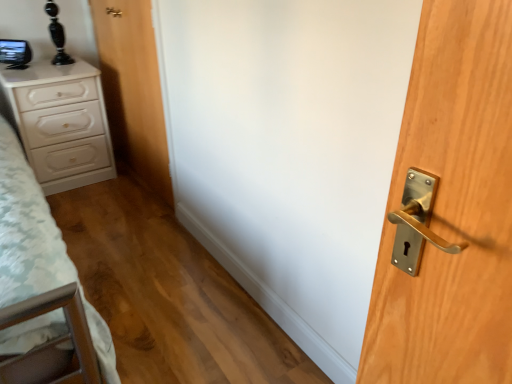
Question: Considering the positions of point (130, 99) and point (57, 97), is point (130, 99) closer or farther from the camera than point (57, 97)?

Choices:
 (A) closer
 (B) farther

Answer: (B)

Question: From the image's perspective, is wooden door at center positioned above or below white glossy chest of drawers at left?

Choices:
 (A) above
 (B) below

Answer: (A)

Question: Is wooden door at center in front of or behind white glossy chest of drawers at left in the image?

Choices:
 (A) behind
 (B) front

Answer: (B)

Question: In terms of height, does white glossy chest of drawers at left look taller or shorter compared to wooden door at center?

Choices:
 (A) short
 (B) tall

Answer: (A)

Question: In terms of width, does white glossy chest of drawers at left look wider or thinner when compared to wooden door at center?

Choices:
 (A) thin
 (B) wide

Answer: (B)

Question: From the image's perspective, is white glossy chest of drawers at left located above or below wooden door at center?

Choices:
 (A) above
 (B) below

Answer: (B)

Question: Is point (78, 74) closer or farther from the camera than point (137, 130)?

Choices:
 (A) closer
 (B) farther

Answer: (A)